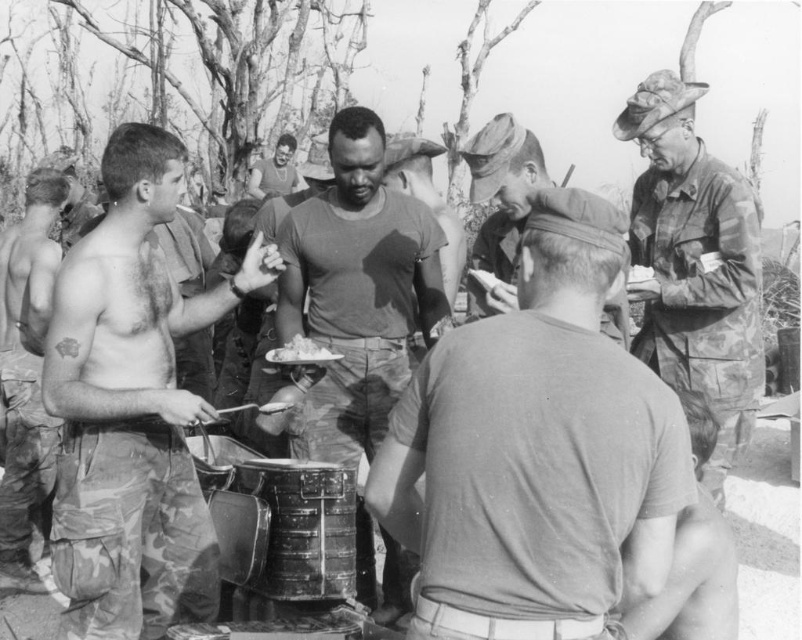
Question: Which point is farther to the camera?

Choices:
 (A) camouflage uniform at right
 (B) dark skin/smooth face at center
 (C) white paper plate at center
 (D) dark gray matte shirt at center

Answer: (B)

Question: Can you confirm if dark gray matte shirt at center is positioned below camouflage uniform at left?

Choices:
 (A) no
 (B) yes

Answer: (B)

Question: Among these points, which one is farthest from the camera?

Choices:
 (A) (752, 339)
 (B) (503, 292)
 (C) (33, 502)
 (D) (323, 346)

Answer: (C)

Question: Does camouflage uniform at center come in front of white paper plate at center?

Choices:
 (A) yes
 (B) no

Answer: (A)

Question: Which is farther from the gray matte shirt at center?

Choices:
 (A) camouflage uniform at left
 (B) camouflage uniform at right
 (C) dark skin/smooth face at center

Answer: (C)

Question: Is camouflage uniform at right bigger than camouflage uniform at left?

Choices:
 (A) yes
 (B) no

Answer: (A)